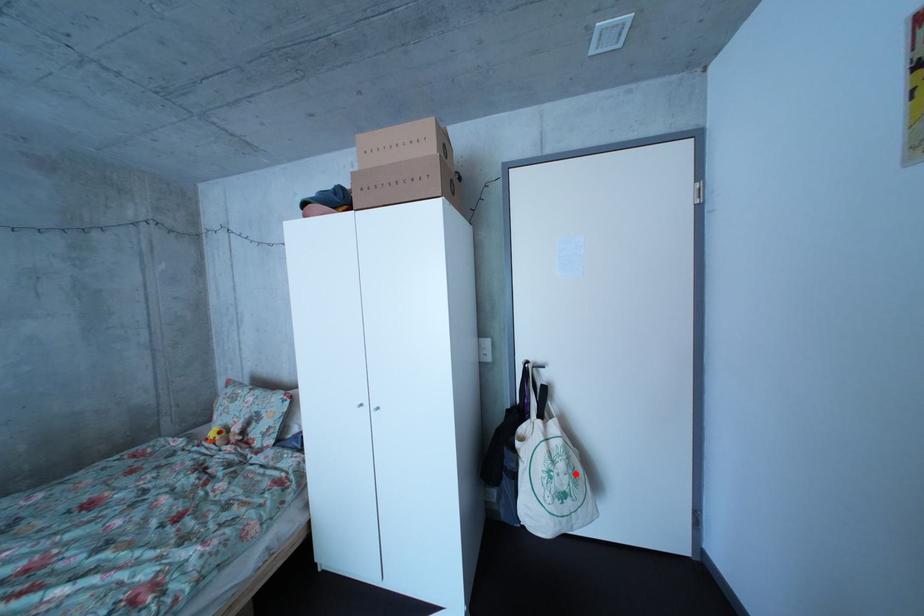
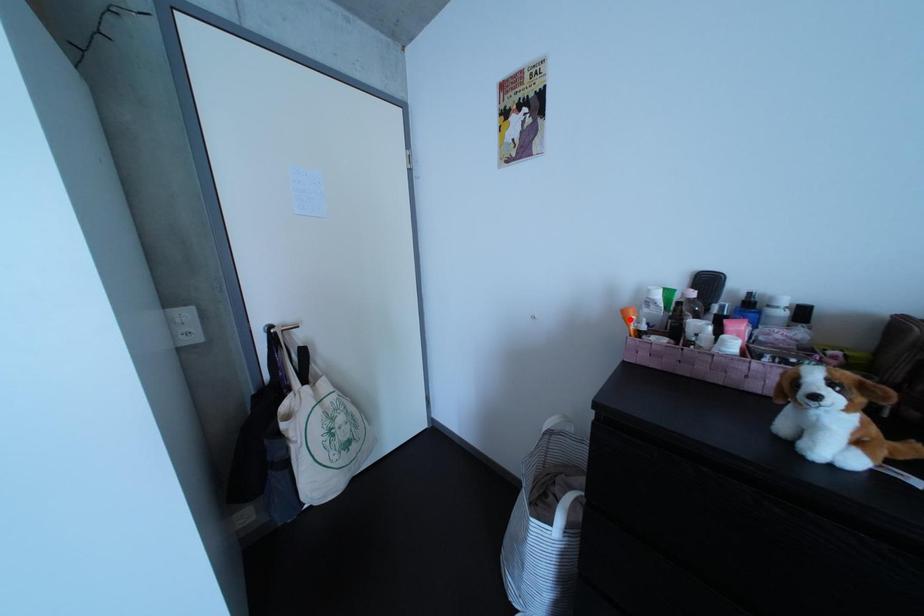
I am providing you with two images of the same scene from different viewpoints. A red point is marked on the first image and another point is marked on the second image. Is the red point in image1 aligned with the point shown in image2?

No